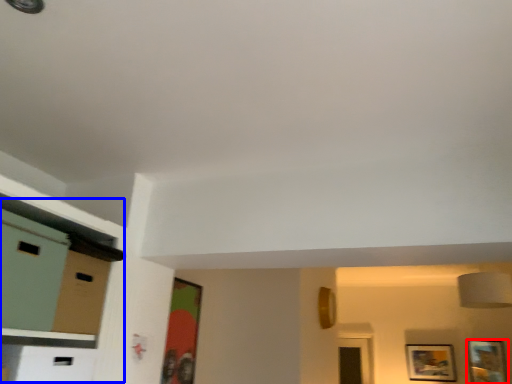
Question: Which of the following is the farthest to the observer, picture frame (highlighted by a red box) or dresser (highlighted by a blue box)?

Choices:
 (A) picture frame
 (B) dresser

Answer: (A)